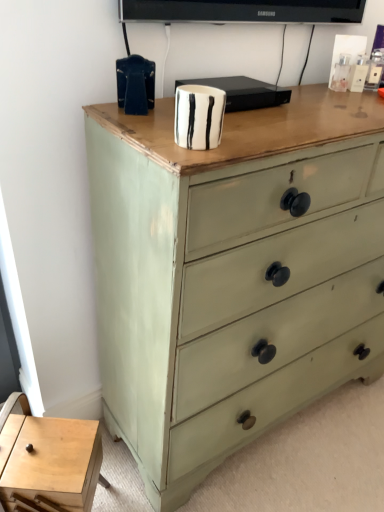
Question: Is sage green painted wood chest of drawers at center looking in the opposite direction of light wood table at lower left?

Choices:
 (A) yes
 (B) no

Answer: (B)

Question: Considering the relative sizes of sage green painted wood chest of drawers at center and light wood table at lower left in the image provided, is sage green painted wood chest of drawers at center smaller than light wood table at lower left?

Choices:
 (A) no
 (B) yes

Answer: (A)

Question: Could light wood table at lower left be considered to be inside sage green painted wood chest of drawers at center?

Choices:
 (A) yes
 (B) no

Answer: (B)

Question: Is sage green painted wood chest of drawers at center at the left side of light wood table at lower left?

Choices:
 (A) no
 (B) yes

Answer: (A)

Question: From a real-world perspective, is sage green painted wood chest of drawers at center positioned under light wood table at lower left based on gravity?

Choices:
 (A) no
 (B) yes

Answer: (A)

Question: From a real-world perspective, does sage green painted wood chest of drawers at center stand above light wood table at lower left?

Choices:
 (A) yes
 (B) no

Answer: (A)

Question: Does light wood table at lower left have a greater height compared to sage green painted wood chest of drawers at center?

Choices:
 (A) yes
 (B) no

Answer: (B)

Question: Is light wood table at lower left not near sage green painted wood chest of drawers at center?

Choices:
 (A) yes
 (B) no

Answer: (B)

Question: Can you confirm if light wood table at lower left is thinner than sage green painted wood chest of drawers at center?

Choices:
 (A) yes
 (B) no

Answer: (A)

Question: Does light wood table at lower left contain sage green painted wood chest of drawers at center?

Choices:
 (A) no
 (B) yes

Answer: (A)

Question: Considering the relative positions of light wood table at lower left and sage green painted wood chest of drawers at center in the image provided, is light wood table at lower left to the right of sage green painted wood chest of drawers at center from the viewer's perspective?

Choices:
 (A) no
 (B) yes

Answer: (A)

Question: Is light wood table at lower left to the left of sage green painted wood chest of drawers at center from the viewer's perspective?

Choices:
 (A) yes
 (B) no

Answer: (A)

Question: Would you say sage green painted wood chest of drawers at center is to the left or to the right of light wood table at lower left in the picture?

Choices:
 (A) left
 (B) right

Answer: (B)